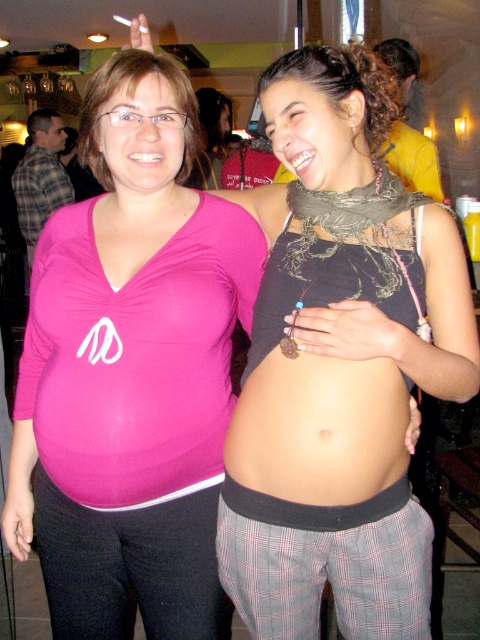
Is point (129, 369) more distant than point (261, 456)?

Yes, point (129, 369) is farther from viewer.

Between point (168, 536) and point (276, 444), which one is positioned behind?

Point (168, 536)

Identify the location of pink matte shirt at left. The image size is (480, 640). (131, 369).

Does matte black tank top at center have a greater height compared to pink matte shirt at left?

No.

Which is above, matte black tank top at center or pink matte shirt at left?

matte black tank top at center

Is point (325, 326) closer to camera compared to point (238, 211)?

Yes, point (325, 326) is closer to viewer.

Locate an element on the screen. matte black tank top at center is located at coordinates (338, 364).

What do you see at coordinates (338, 364) in the screenshot? This screenshot has height=640, width=480. I see `matte black tank top at center` at bounding box center [338, 364].

The width and height of the screenshot is (480, 640). What are the coordinates of `matte black tank top at center` in the screenshot? It's located at (x=338, y=364).